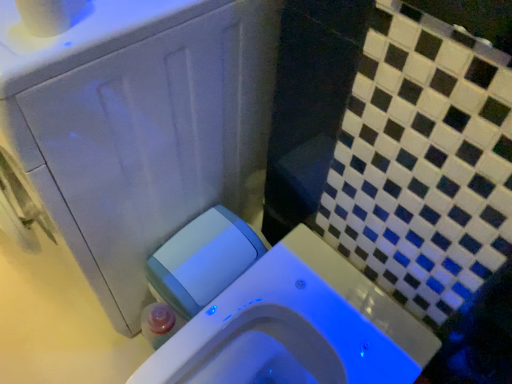
The image size is (512, 384). I want to click on empty space that is ontop of white plastic water tank at lower left (from a real-world perspective), so click(199, 247).